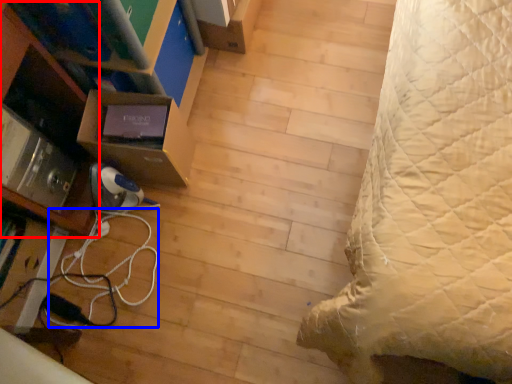
Question: Which object is further to the camera taking this photo, shelf (highlighted by a red box) or cable (highlighted by a blue box)?

Choices:
 (A) shelf
 (B) cable

Answer: (B)